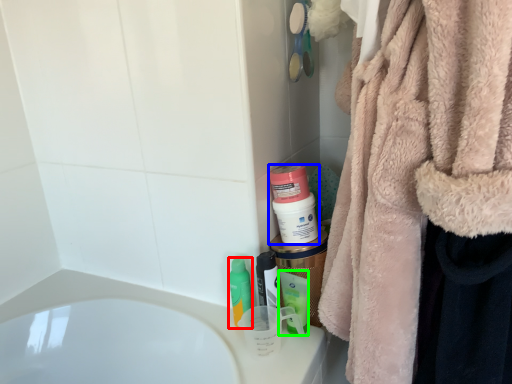
Question: Considering the real-world distances, which object is closest to mouthwash (highlighted by a red box)? mouthwash (highlighted by a blue box) or mouthwash (highlighted by a green box).

Choices:
 (A) mouthwash
 (B) mouthwash

Answer: (B)